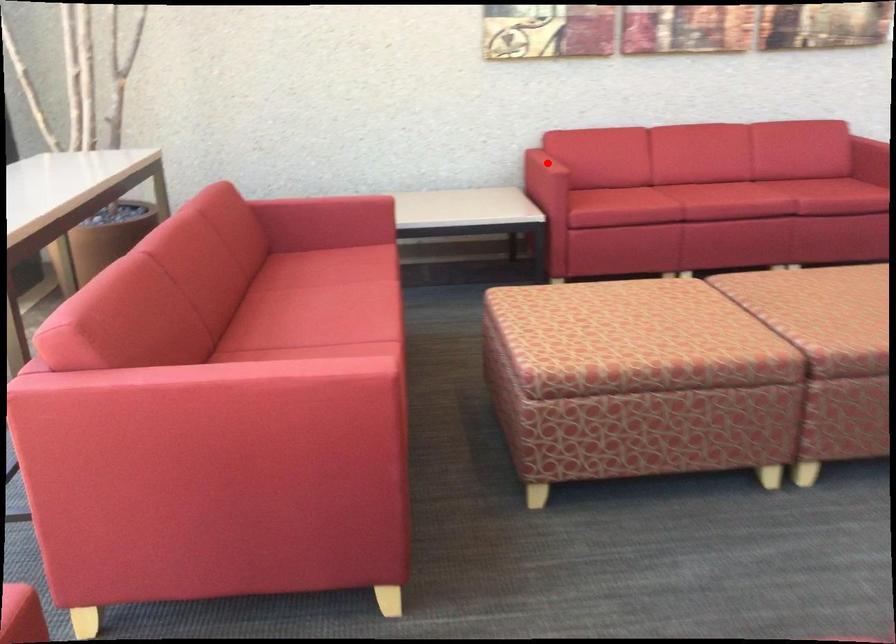
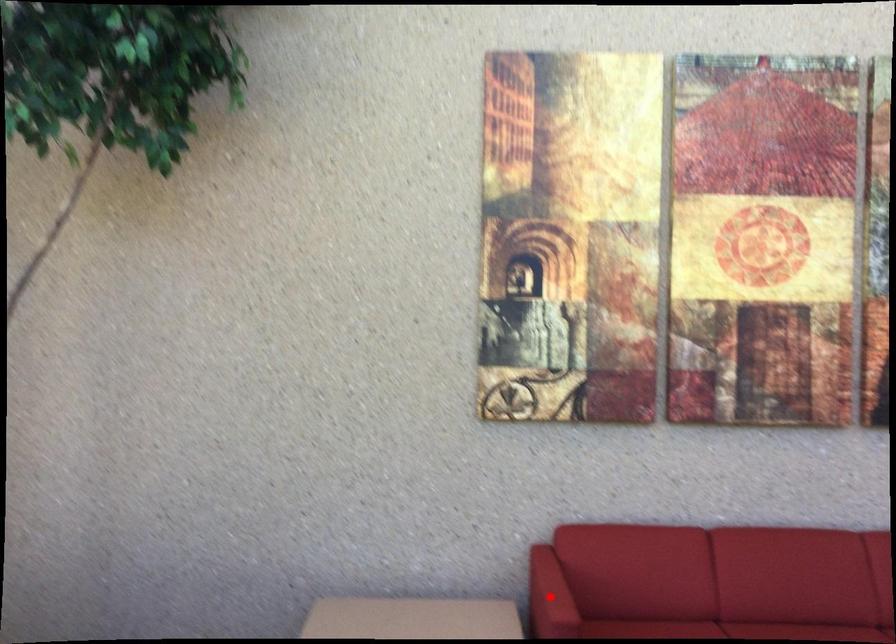
I am providing you with two images of the same scene from different viewpoints. A red point is marked on the first image and another point is marked on the second image. Does the point marked in image1 correspond to the same location as the one in image2?

Yes